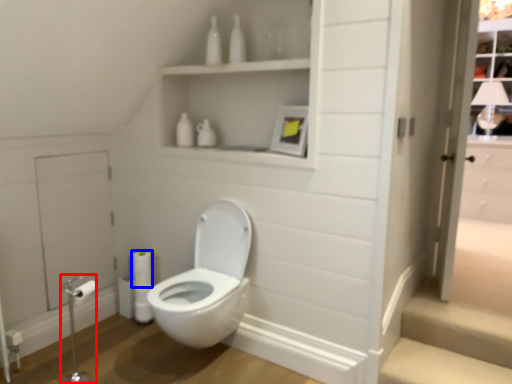
Question: Which object is closer to the camera taking this photo, towel bar (highlighted by a red box) or toilet paper (highlighted by a blue box)?

Choices:
 (A) towel bar
 (B) toilet paper

Answer: (A)